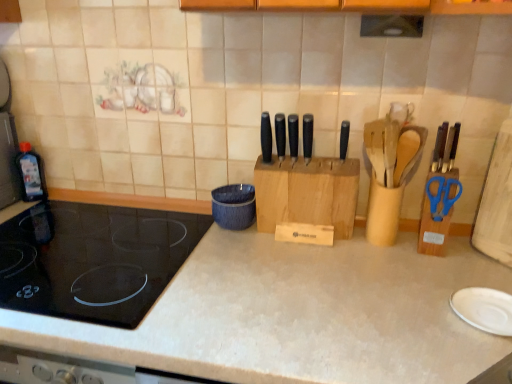
I want to click on free space in front of blue textured bowl at center, so click(230, 257).